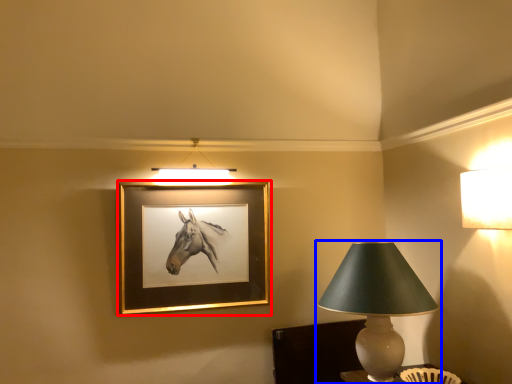
Question: Which point is closer to the camera, picture frame (highlighted by a red box) or lamp (highlighted by a blue box)?

Choices:
 (A) picture frame
 (B) lamp

Answer: (B)